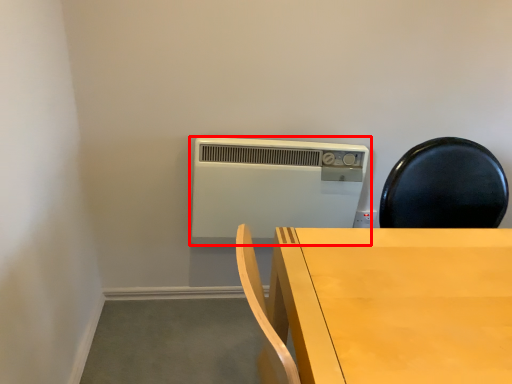
Question: Considering the relative positions of home appliance (annotated by the red box) and table in the image provided, where is home appliance (annotated by the red box) located with respect to the staircase?

Choices:
 (A) left
 (B) right

Answer: (A)